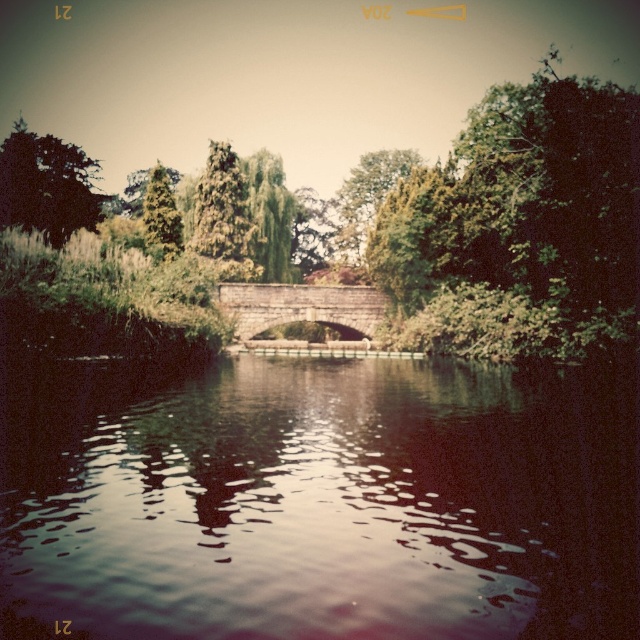
Is the position of green leafy tree at upper right less distant than that of green textured tree at upper left?

That is True.

The height and width of the screenshot is (640, 640). Describe the element at coordinates (522, 220) in the screenshot. I see `green leafy tree at upper right` at that location.

Image resolution: width=640 pixels, height=640 pixels. I want to click on green leafy tree at upper right, so click(522, 220).

The width and height of the screenshot is (640, 640). In order to click on green leafy tree at upper right in this screenshot , I will do pyautogui.click(x=522, y=220).

Is green leafy tree at upper right closer to the viewer compared to green leafy tree at upper left?

That is True.

Does point (476, 248) lie in front of point (40, 164)?

That is True.

I want to click on green leafy tree at upper right, so click(x=522, y=220).

Is dark reflective water at center below green leafy tree at upper right?

Correct, dark reflective water at center is located below green leafy tree at upper right.

Is dark reflective water at center to the right of green leafy tree at upper right from the viewer's perspective?

In fact, dark reflective water at center is to the left of green leafy tree at upper right.

The height and width of the screenshot is (640, 640). Identify the location of dark reflective water at center. (323, 502).

At what (x,y) coordinates should I click in order to perform the action: click on dark reflective water at center. Please return your answer as a coordinate pair (x, y). The width and height of the screenshot is (640, 640). Looking at the image, I should click on (323, 502).